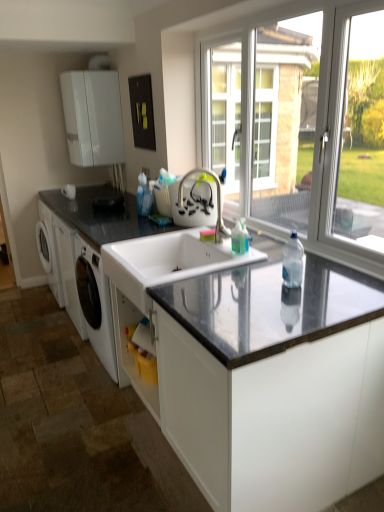
The image size is (384, 512). What are the coordinates of `black granite countertop at center, which is the 1th countertop in bottom-to-top order` in the screenshot? It's located at (254, 368).

This screenshot has height=512, width=384. What do you see at coordinates (217, 201) in the screenshot? I see `satin nickel faucet at center` at bounding box center [217, 201].

The height and width of the screenshot is (512, 384). What are the coordinates of `white matte cabinet at upper left` in the screenshot? It's located at (93, 117).

Describe the element at coordinates (292, 262) in the screenshot. The width and height of the screenshot is (384, 512). I see `clear plastic bottle at center` at that location.

You are a GUI agent. You are given a task and a screenshot of the screen. Output one action in this format:
    pyautogui.click(x=<x>, y=<y>)
    Task: Click on the black granite countertop at left, which is the first countertop in top-to-bottom order
    
    Given the screenshot: What is the action you would take?
    click(102, 215)

Measure the distance between black granite countertop at left, which ranks as the 2th countertop in bottom-to-top order, and camera.

A distance of 2.34 meters exists between black granite countertop at left, which ranks as the 2th countertop in bottom-to-top order, and camera.

Locate an element on the screen. Image resolution: width=384 pixels, height=512 pixels. transparent glass window at upper right is located at coordinates (306, 129).

From the image's perspective, which is below, clear plastic bottle at center or black granite countertop at center, the second countertop in the top-to-bottom sequence?

black granite countertop at center, the second countertop in the top-to-bottom sequence.

Would you say clear plastic bottle at center is inside or outside black granite countertop at center, which is the 1th countertop in bottom-to-top order?

clear plastic bottle at center is outside black granite countertop at center, which is the 1th countertop in bottom-to-top order.

Considering the sizes of objects clear plastic bottle at center and black granite countertop at center, which is the 1th countertop in bottom-to-top order, in the image provided, who is bigger, clear plastic bottle at center or black granite countertop at center, which is the 1th countertop in bottom-to-top order,?

Bigger between the two is black granite countertop at center, which is the 1th countertop in bottom-to-top order.

Is point (138, 233) positioned behind point (203, 415)?

Yes, it is.

You are a GUI agent. You are given a task and a screenshot of the screen. Output one action in this format:
    pyautogui.click(x=<x>, y=<y>)
    Task: Click on the countertop in front of the black granite countertop at left, which is the first countertop in top-to-bottom order
    
    Given the screenshot: What is the action you would take?
    pyautogui.click(x=254, y=368)

Can you confirm if black granite countertop at left, which ranks as the 2th countertop in bottom-to-top order, is wider than black granite countertop at center, the second countertop in the top-to-bottom sequence?

No.

Considering the sizes of objects white ceramic sink at center and black granite countertop at left, which ranks as the 2th countertop in bottom-to-top order, in the image provided, who is smaller, white ceramic sink at center or black granite countertop at left, which ranks as the 2th countertop in bottom-to-top order,?

white ceramic sink at center is smaller.

How many degrees apart are the facing directions of white ceramic sink at center and black granite countertop at left, which is the first countertop in top-to-bottom order?

The facing directions of white ceramic sink at center and black granite countertop at left, which is the first countertop in top-to-bottom order, are 1.16 degrees apart.

Image resolution: width=384 pixels, height=512 pixels. What are the coordinates of `countertop on the left of white ceramic sink at center` in the screenshot? It's located at (102, 215).

From the image's perspective, is white ceramic sink at center located above or below black granite countertop at left, which ranks as the 2th countertop in bottom-to-top order?

white ceramic sink at center is situated lower than black granite countertop at left, which ranks as the 2th countertop in bottom-to-top order, in the image.

Can you confirm if satin nickel faucet at center is positioned to the right of white matte cabinet at upper left?

Indeed, satin nickel faucet at center is positioned on the right side of white matte cabinet at upper left.

From a real-world perspective, between satin nickel faucet at center and white matte cabinet at upper left, who is vertically lower?

satin nickel faucet at center, from a real-world perspective.

Is satin nickel faucet at center located outside white matte cabinet at upper left?

Yes, satin nickel faucet at center is located beyond the bounds of white matte cabinet at upper left.

How many degrees apart are the facing directions of black granite countertop at left, which is the first countertop in top-to-bottom order, and white ceramic sink at center?

black granite countertop at left, which is the first countertop in top-to-bottom order, and white ceramic sink at center are facing 1.16 degrees away from each other.

Which of these two, black granite countertop at left, which is the first countertop in top-to-bottom order, or white ceramic sink at center, is smaller?

Smaller between the two is white ceramic sink at center.

From a real-world perspective, which object stands above the other?

black granite countertop at left, which is the first countertop in top-to-bottom order, is physically above.

Do you think black granite countertop at left, which is the first countertop in top-to-bottom order, is within white ceramic sink at center, or outside of it?

black granite countertop at left, which is the first countertop in top-to-bottom order, cannot be found inside white ceramic sink at center.

Is transparent glass window at upper right thinner than white ceramic sink at center?

Yes, transparent glass window at upper right is thinner than white ceramic sink at center.

Which object is positioned more to the right, transparent glass window at upper right or white ceramic sink at center?

transparent glass window at upper right.

Measure the distance from transparent glass window at upper right to white ceramic sink at center.

They are 26.99 inches apart.

Which of these two, transparent glass window at upper right or white ceramic sink at center, stands taller?

With more height is transparent glass window at upper right.

From a real-world perspective, is black granite countertop at left, which is the first countertop in top-to-bottom order, on satin nickel faucet at center?

Incorrect, from a real-world perspective, black granite countertop at left, which is the first countertop in top-to-bottom order, is lower than satin nickel faucet at center.

Identify the location of countertop that is on the left side of satin nickel faucet at center. This screenshot has width=384, height=512. (102, 215).

Between black granite countertop at left, which is the first countertop in top-to-bottom order, and satin nickel faucet at center, which one appears on the left side from the viewer's perspective?

black granite countertop at left, which is the first countertop in top-to-bottom order.

From the image's perspective, is black granite countertop at left, which ranks as the 2th countertop in bottom-to-top order, above or below satin nickel faucet at center?

Clearly, from the image's perspective, black granite countertop at left, which ranks as the 2th countertop in bottom-to-top order, is above satin nickel faucet at center.

Locate an element on the screen. bottle behind the black granite countertop at center, which is the 1th countertop in bottom-to-top order is located at coordinates (292, 262).

In the image, there is a black granite countertop at left, which is the first countertop in top-to-bottom order. Where is `countertop below it (from a real-world perspective)`? countertop below it (from a real-world perspective) is located at coordinates (254, 368).

From the image, which object appears to be nearer to transparent glass window at upper right, black granite countertop at left, which is the first countertop in top-to-bottom order, or white matte cabinet at upper left?

black granite countertop at left, which is the first countertop in top-to-bottom order, lies closer to transparent glass window at upper right than the other object.

When comparing their distances from clear plastic bottle at center, does black granite countertop at center, which is the 1th countertop in bottom-to-top order, or black granite countertop at left, which ranks as the 2th countertop in bottom-to-top order, seem closer?

Among the two, black granite countertop at center, which is the 1th countertop in bottom-to-top order, is located nearer to clear plastic bottle at center.

Considering their positions, is transparent glass window at upper right positioned closer to white matte cabinet at upper left than black granite countertop at center, the second countertop in the top-to-bottom sequence?

transparent glass window at upper right.

Looking at the image, which one is located further to satin nickel faucet at center, white matte cabinet at upper left or clear plastic bottle at center?

white matte cabinet at upper left lies further to satin nickel faucet at center than the other object.

Based on their spatial positions, is white matte cabinet at upper left or clear plastic bottle at center closer to black granite countertop at left, which is the first countertop in top-to-bottom order?

Among the two, white matte cabinet at upper left is located nearer to black granite countertop at left, which is the first countertop in top-to-bottom order.

From the image, which object appears to be farther from clear plastic bottle at center, black granite countertop at left, which ranks as the 2th countertop in bottom-to-top order, or white matte cabinet at upper left?

Among the two, white matte cabinet at upper left is located further to clear plastic bottle at center.

Which object lies further to the anchor point satin nickel faucet at center, black granite countertop at center, the second countertop in the top-to-bottom sequence, or black granite countertop at left, which is the first countertop in top-to-bottom order?

The object further to satin nickel faucet at center is black granite countertop at center, the second countertop in the top-to-bottom sequence.

Based on their spatial positions, is black granite countertop at center, the second countertop in the top-to-bottom sequence, or white ceramic sink at center closer to white matte cabinet at upper left?

white ceramic sink at center lies closer to white matte cabinet at upper left than the other object.

Find the location of a particular element. sink between clear plastic bottle at center and white matte cabinet at upper left from front to back is located at coordinates (168, 260).

At what (x,y) coordinates should I click in order to perform the action: click on sink between transparent glass window at upper right and white matte cabinet at upper left in the front-back direction. Please return your answer as a coordinate pair (x, y). Looking at the image, I should click on (168, 260).

Locate an element on the screen. The width and height of the screenshot is (384, 512). bottle between transparent glass window at upper right and black granite countertop at center, which is the 1th countertop in bottom-to-top order, vertically is located at coordinates (292, 262).

Find the location of a particular element. tap between white ceramic sink at center and white matte cabinet at upper left from front to back is located at coordinates (217, 201).